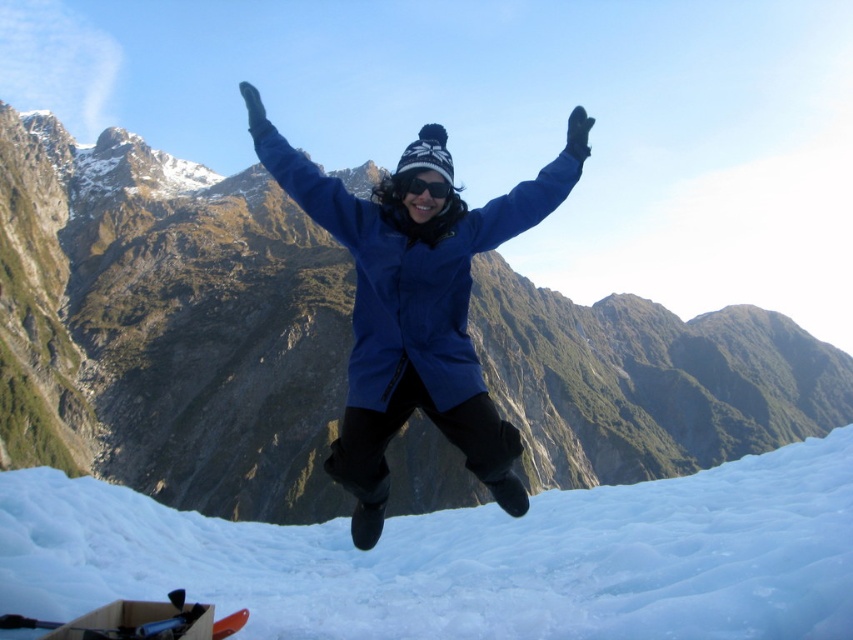
You are a photographer trying to capture the perfect shot of the person jumping. You notice the white frosty snow at lower center and the black matte goggles at center. Which object is closer to the camera based on their positions?

The white frosty snow at lower center is in front of the black matte goggles at center, so it is closer to the camera.

You are a photographer trying to capture the perfect shot of the person jumping. You notice the matte blue jacket at center and the black matte goggles at center. Which object is lower in the image?

The matte blue jacket at center is positioned under the black matte goggles at center, so the jacket is lower than the goggles.